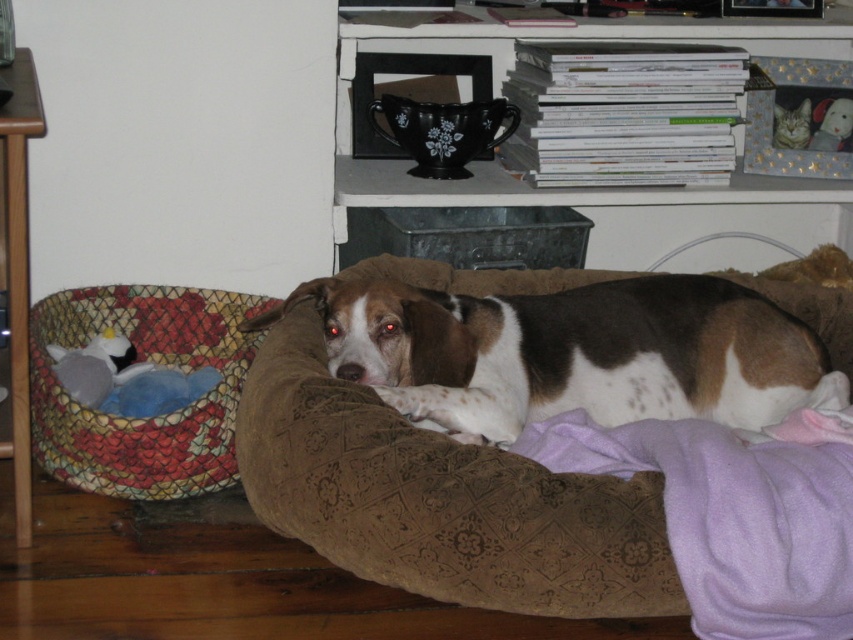
You are a guest in this home and want to place a small gift on the table behind the brown and white fur at center. Is the black ceramic mug at upper center blocking your path?

The brown and white fur at center is in front of the black ceramic mug at upper center, so placing the gift behind the fur would not be obstructed by the mug since the fur is closer to you.

You are a guest in this room and want to place a small gift on the table near the black ceramic mug at upper center without disturbing the dog resting on the brown and white fur at center. Where should you place the gift?

Place the gift on the table near the black ceramic mug at upper center. Since the brown and white fur at center is located below the mug, the dog is resting below the mug, so placing the gift near the mug on the table would keep it away from the dog.